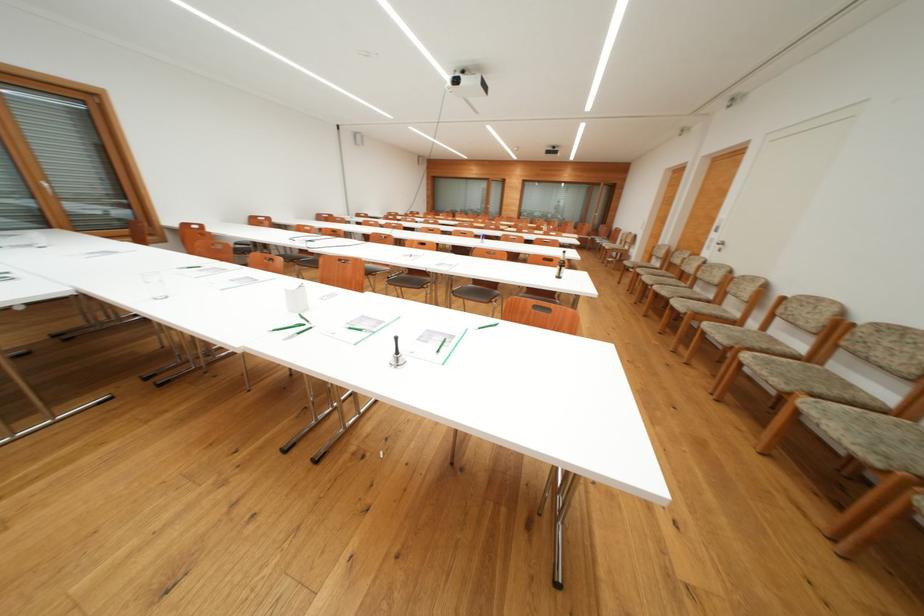
The height and width of the screenshot is (616, 924). Identify the location of brown glass bottle. (396, 355).